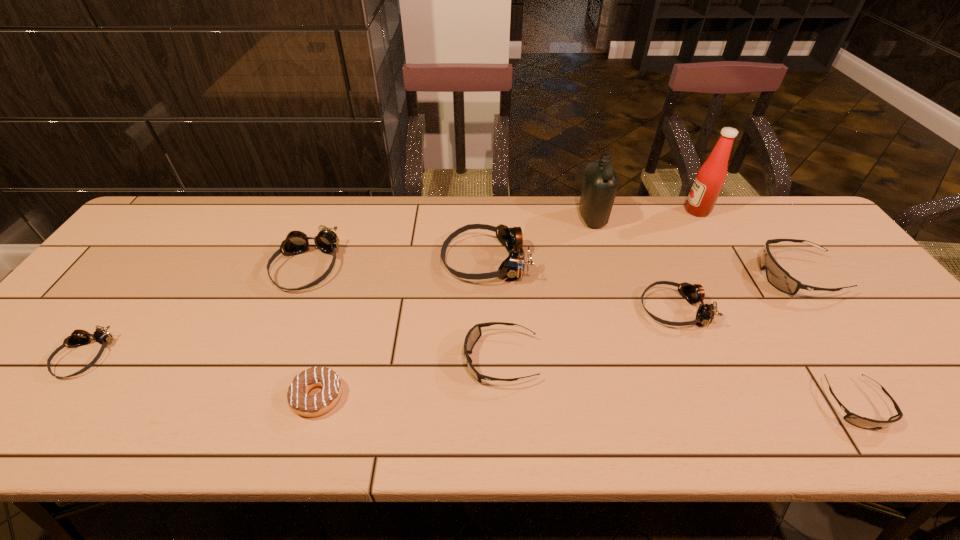
Find the location of `vacant space located 0.130m on the lenses of the second biggest black goggles`. vacant space located 0.130m on the lenses of the second biggest black goggles is located at coordinates (408, 360).

Image resolution: width=960 pixels, height=540 pixels. I want to click on blank area located on the lenses of the second biggest black goggles, so click(429, 360).

This screenshot has width=960, height=540. I want to click on free point located on the lenses of the second biggest black goggles, so pos(420,360).

You are a GUI agent. You are given a task and a screenshot of the screen. Output one action in this format:
    pyautogui.click(x=<x>, y=<y>)
    Task: Click on the vacant space situated 0.070m through the lenses of the leftmost object
    The height and width of the screenshot is (540, 960).
    Given the screenshot: What is the action you would take?
    pyautogui.click(x=44, y=409)

This screenshot has width=960, height=540. What are the coordinates of `free space located 0.380m on the right of the chocolate doughnut` in the screenshot? It's located at (519, 396).

Where is `condiment located at the far edge`? condiment located at the far edge is located at coordinates (710, 178).

Find the location of a particular element. Image resolution: width=960 pixels, height=540 pixels. bottle present at the far edge is located at coordinates (600, 184).

Where is `doughnut that is at the near edge`? The width and height of the screenshot is (960, 540). doughnut that is at the near edge is located at coordinates (302, 403).

Locate an element on the screen. The height and width of the screenshot is (540, 960). goggles that is at the near edge is located at coordinates (862, 422).

Locate an element on the screen. This screenshot has width=960, height=540. object at the left edge is located at coordinates (78, 337).